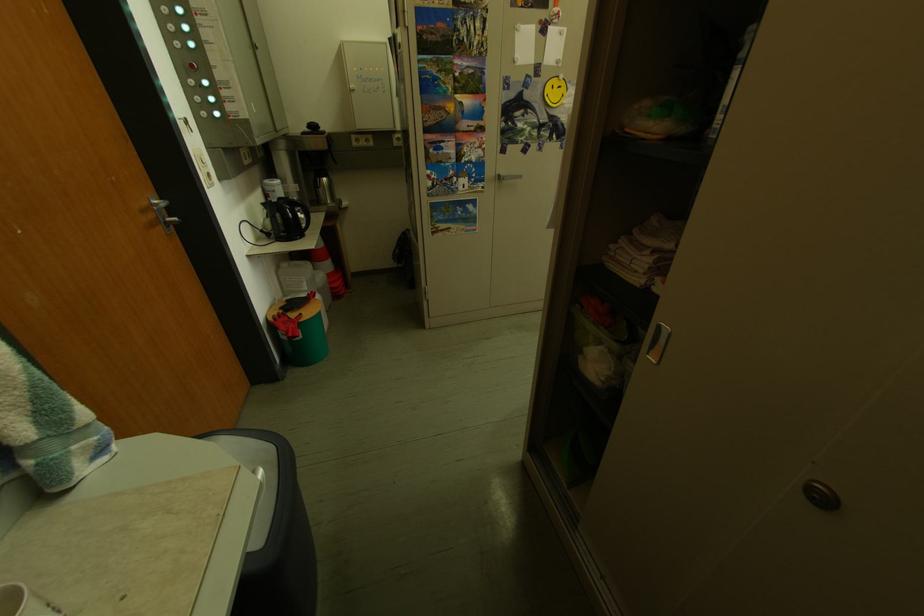
Find where to push the red panel button. Please return your answer as a coordinate pair (x, y).

(191, 66)